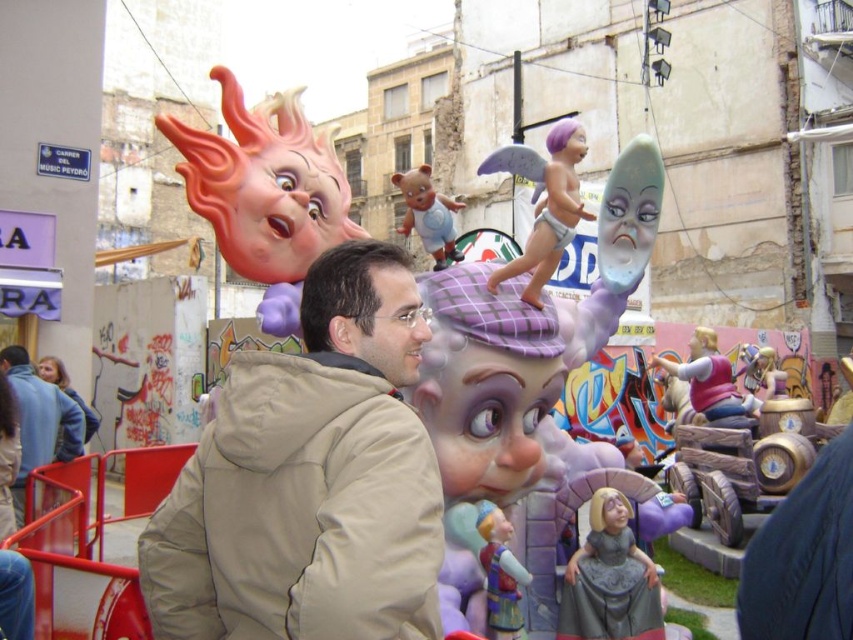
Is tan fabric jacket at center shorter than beige fabric jacket at lower left?

In fact, tan fabric jacket at center may be taller than beige fabric jacket at lower left.

Is tan fabric jacket at center taller than beige fabric jacket at lower left?

Yes, tan fabric jacket at center is taller than beige fabric jacket at lower left.

Does point (373, 612) lie behind point (22, 432)?

No, (373, 612) is in front of (22, 432).

The width and height of the screenshot is (853, 640). Find the location of `tan fabric jacket at center`. tan fabric jacket at center is located at coordinates (309, 480).

Which is more to the left, purple matte angel at center or matte plastic bear at center?

matte plastic bear at center

Between point (558, 122) and point (425, 189), which one is positioned behind?

Positioned behind is point (558, 122).

The height and width of the screenshot is (640, 853). Describe the element at coordinates (543, 204) in the screenshot. I see `purple matte angel at center` at that location.

Identify the location of purple matte angel at center. (543, 204).

Can you confirm if matte plastic head at upper left is thinner than matte plastic bear at center?

No, matte plastic head at upper left is not thinner than matte plastic bear at center.

Describe the element at coordinates (265, 193) in the screenshot. I see `matte plastic head at upper left` at that location.

Where is `matte plastic head at upper left`? matte plastic head at upper left is located at coordinates (265, 193).